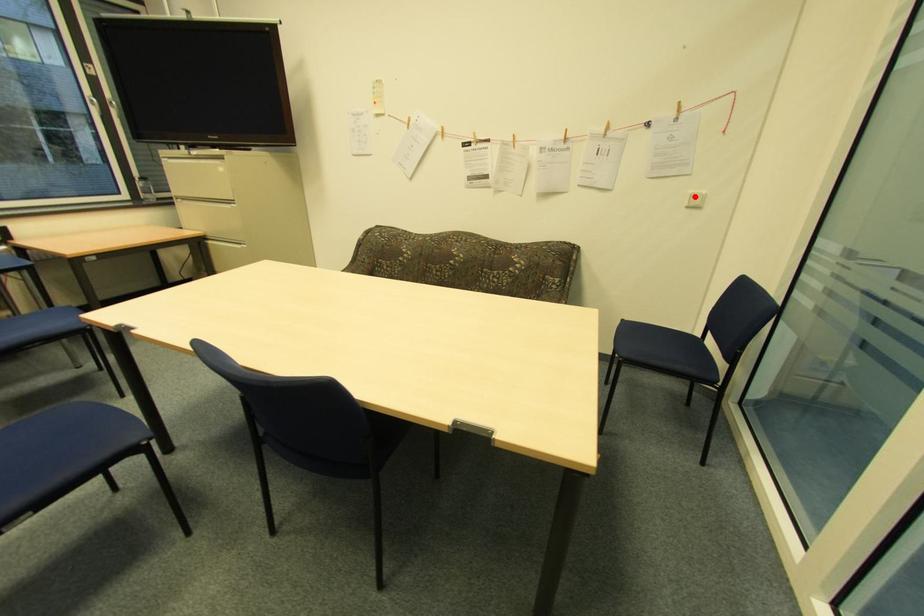
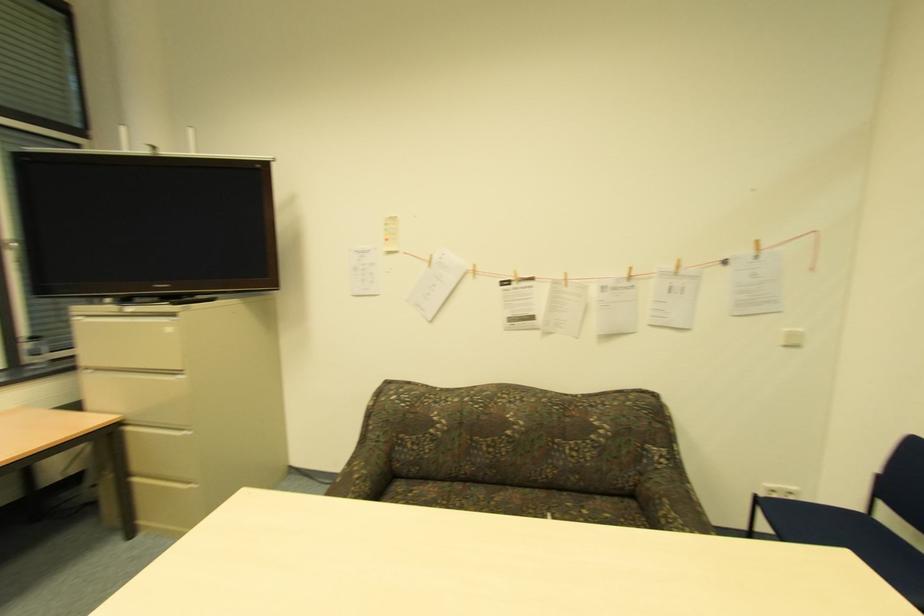
In the second image, find the point that corresponds to the highlighted location in the first image.

(792, 334)